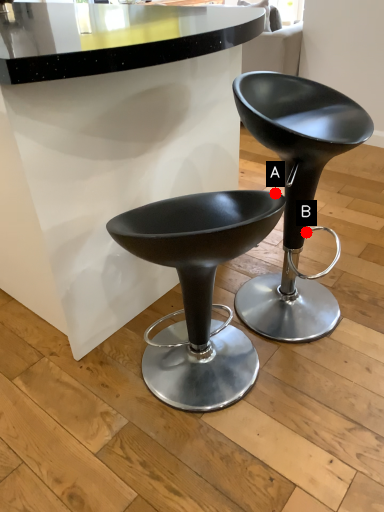
Question: Two points are circled on the image, labeled by A and B beside each circle. Among these points, which one is nearest to the camera?

Choices:
 (A) A is closer
 (B) B is closer

Answer: (A)